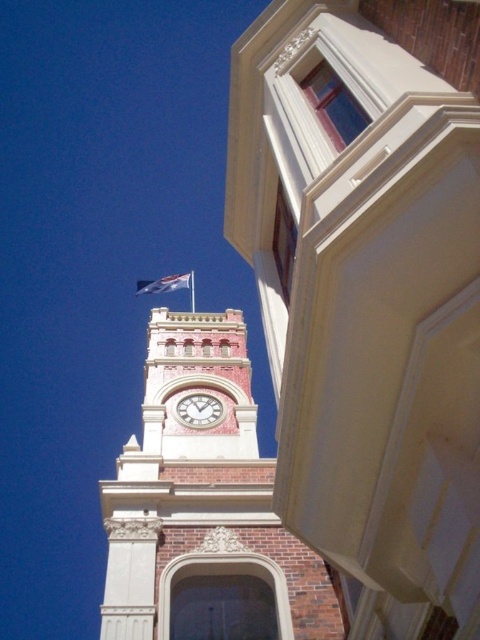
Is matte pink clock at center shorter than white fabric flag at upper center?

Correct, matte pink clock at center is not as tall as white fabric flag at upper center.

Is matte pink clock at center below white fabric flag at upper center?

Yes.

Where is `matte pink clock at center`? matte pink clock at center is located at coordinates (200, 410).

Is brick clock tower at center above matte pink clock at center?

Yes, brick clock tower at center is above matte pink clock at center.

From the picture: Is brick clock tower at center to the right of matte pink clock at center from the viewer's perspective?

No, brick clock tower at center is not to the right of matte pink clock at center.

The height and width of the screenshot is (640, 480). I want to click on brick clock tower at center, so click(204, 508).

Between brick clock tower at center and white fabric flag at upper center, which one has less height?

Standing shorter between the two is white fabric flag at upper center.

Where is `brick clock tower at center`? The height and width of the screenshot is (640, 480). brick clock tower at center is located at coordinates (204, 508).